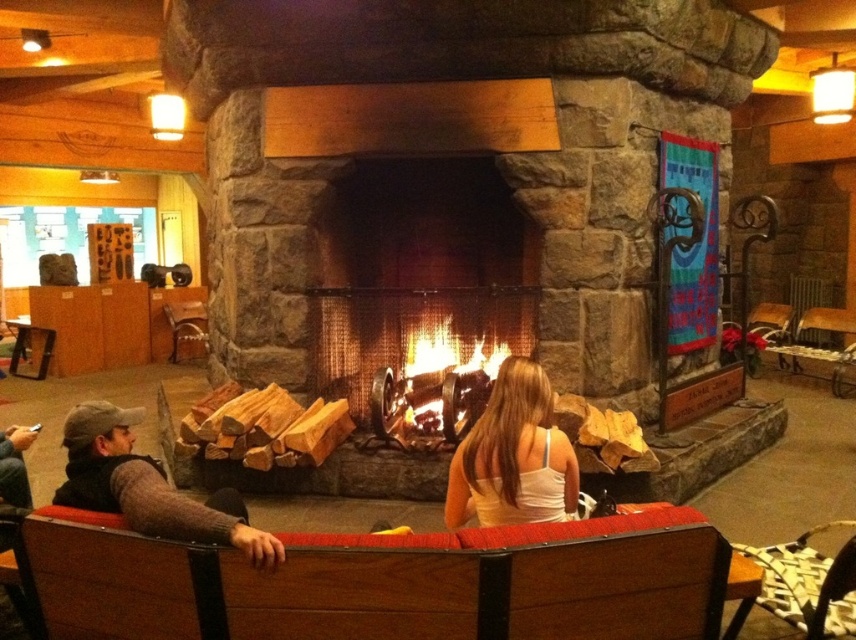
You are a firefighter assessing the safety of the fireplace setup. The safety guidelines state that flammable materials must be at least 30 centimeters away from an active fire. Based on the scene, are the wooden logs at center positioned safely relative to the charcoal wood fire at center?

The distance between the wooden logs at center and the charcoal wood fire at center is 29.41 centimeters, which is less than the required 30 centimeters. Therefore, the wooden logs at center are not positioned safely and should be moved further away to comply with safety guidelines.

You are a firewood supplier who needs to deliver logs to the fireplace. The logs you have are 4.08 meters long. The wooden logs at center in the image are 4.08 meters apart. Can you fit your logs between them?

The wooden logs at center are 4.08 meters apart. The logs you have are also 4.08 meters long. Since the distance between the logs matches the length of your logs, you can fit them between the wooden logs at center.